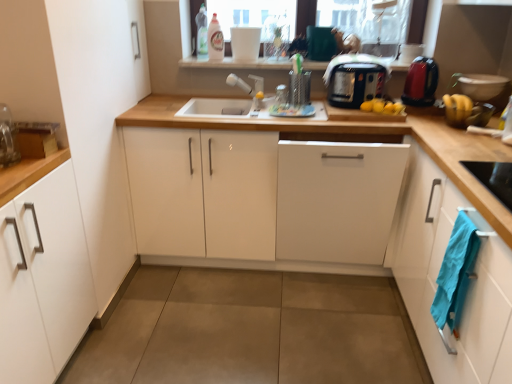
Question: Does blue cotton towel at lower right have a smaller size compared to white glossy cabinet at center, arranged as the second cabinetry when viewed from the left?

Choices:
 (A) yes
 (B) no

Answer: (A)

Question: Is blue cotton towel at lower right closer to the viewer compared to white glossy cabinet at center, arranged as the second cabinetry when viewed from the left?

Choices:
 (A) no
 (B) yes

Answer: (B)

Question: Does blue cotton towel at lower right have a greater height compared to white glossy cabinet at center, the third cabinetry when ordered from right to left?

Choices:
 (A) no
 (B) yes

Answer: (A)

Question: Is blue cotton towel at lower right completely or partially outside of white glossy cabinet at center, the third cabinetry when ordered from right to left?

Choices:
 (A) yes
 (B) no

Answer: (A)

Question: Is blue cotton towel at lower right further to camera compared to white glossy cabinet at center, the third cabinetry when ordered from right to left?

Choices:
 (A) yes
 (B) no

Answer: (B)

Question: Is blue cotton towel at lower right to the right of white glossy cabinet at center, the third cabinetry when ordered from right to left, from the viewer's perspective?

Choices:
 (A) yes
 (B) no

Answer: (A)

Question: Considering the relative positions of white matte cabinet at left, marked as the 1th cabinetry in a left-to-right arrangement, and white matte cabinet at center, placed as the second cabinetry when sorted from right to left, in the image provided, is white matte cabinet at left, marked as the 1th cabinetry in a left-to-right arrangement, to the left of white matte cabinet at center, placed as the second cabinetry when sorted from right to left, from the viewer's perspective?

Choices:
 (A) yes
 (B) no

Answer: (A)

Question: Is white matte cabinet at left, marked as the 1th cabinetry in a left-to-right arrangement, looking in the opposite direction of white matte cabinet at center, placed as the second cabinetry when sorted from right to left?

Choices:
 (A) no
 (B) yes

Answer: (A)

Question: From a real-world perspective, is white matte cabinet at left, marked as the 1th cabinetry in a left-to-right arrangement, physically below white matte cabinet at center, the 3th cabinetry positioned from the left?

Choices:
 (A) yes
 (B) no

Answer: (B)

Question: Is white matte cabinet at left, the fourth cabinetry in the right-to-left sequence, placed right next to white matte cabinet at center, placed as the second cabinetry when sorted from right to left?

Choices:
 (A) no
 (B) yes

Answer: (A)

Question: From the image's perspective, is white matte cabinet at left, marked as the 1th cabinetry in a left-to-right arrangement, located above white matte cabinet at center, placed as the second cabinetry when sorted from right to left?

Choices:
 (A) yes
 (B) no

Answer: (B)

Question: Would you say white matte cabinet at left, the fourth cabinetry in the right-to-left sequence, contains white matte cabinet at center, the 3th cabinetry positioned from the left?

Choices:
 (A) yes
 (B) no

Answer: (B)

Question: Is white glossy cabinet at center, the third cabinetry when ordered from right to left, to the right of white matte cabinet at left, the fourth cabinetry in the right-to-left sequence, from the viewer's perspective?

Choices:
 (A) yes
 (B) no

Answer: (A)